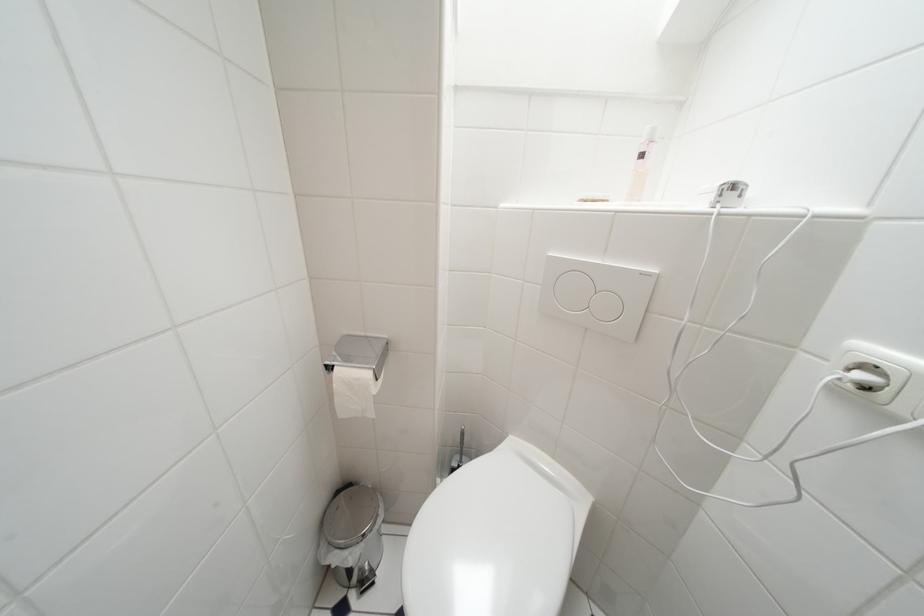
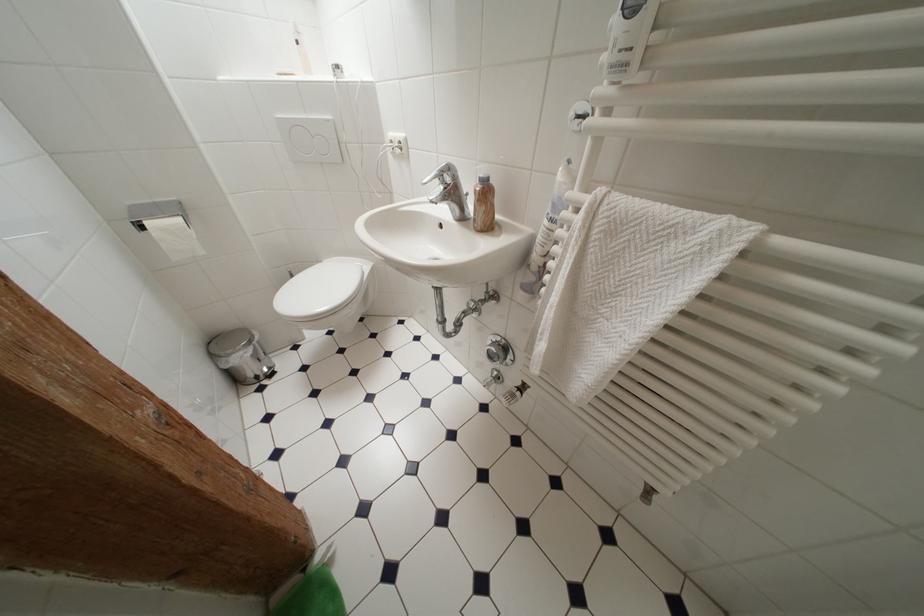
Find the pixel in the second image that matches point 649,277 in the first image.

(333, 124)